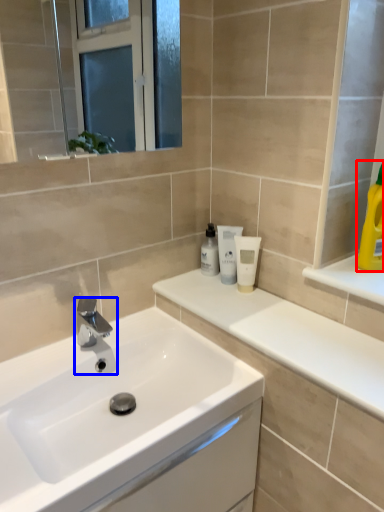
Question: Which object is closer to the camera taking this photo, cleaning product (highlighted by a red box) or tap (highlighted by a blue box)?

Choices:
 (A) cleaning product
 (B) tap

Answer: (A)